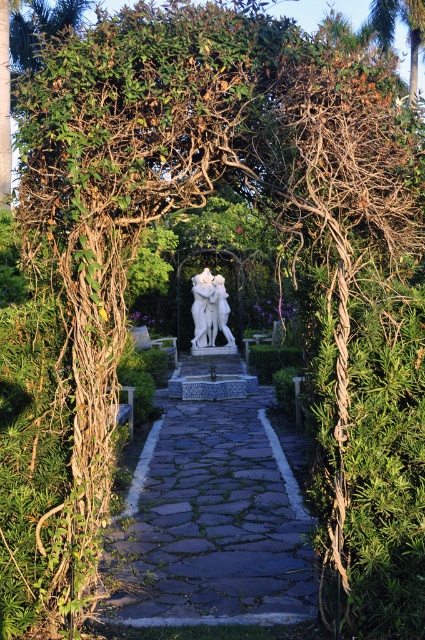
Measure the distance between stone cobblestone path at center and camera.

stone cobblestone path at center and camera are 4.64 meters apart.

Is point (235, 566) positioned before point (214, 316)?

That is True.

Where is `stone cobblestone path at center`? Image resolution: width=425 pixels, height=640 pixels. stone cobblestone path at center is located at coordinates (212, 522).